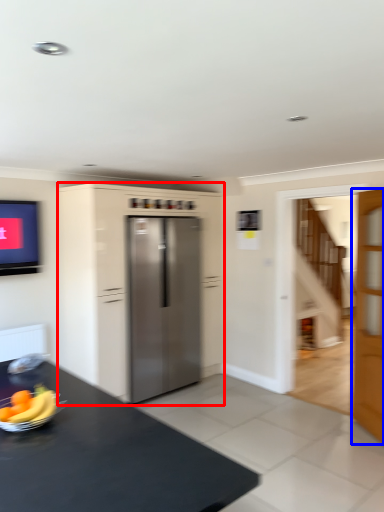
Question: Which object is closer to the camera taking this photo, cabinetry (highlighted by a red box) or door (highlighted by a blue box)?

Choices:
 (A) cabinetry
 (B) door

Answer: (B)